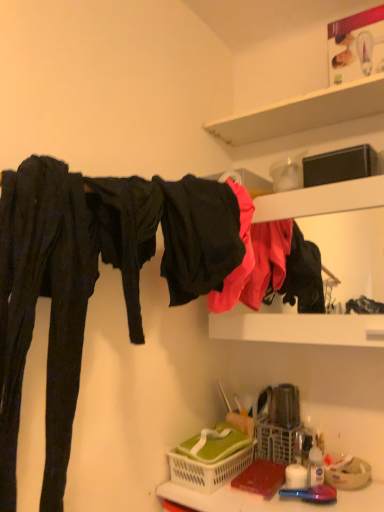
Question: Does black matte fabric at upper center come in front of green plastic basket at lower center, the 2th basket positioned from the right?

Choices:
 (A) no
 (B) yes

Answer: (B)

Question: Considering the relative sizes of black matte fabric at upper center and green plastic basket at lower center, the 2th basket positioned from the right, in the image provided, is black matte fabric at upper center thinner than green plastic basket at lower center, the 2th basket positioned from the right,?

Choices:
 (A) no
 (B) yes

Answer: (B)

Question: From a real-world perspective, is black matte fabric at upper center on top of green plastic basket at lower center, positioned as the 1th basket in left-to-right order?

Choices:
 (A) yes
 (B) no

Answer: (A)

Question: Can you confirm if black matte fabric at upper center is positioned to the left of green plastic basket at lower center, positioned as the 1th basket in left-to-right order?

Choices:
 (A) yes
 (B) no

Answer: (A)

Question: Can you confirm if black matte fabric at upper center is positioned to the right of green plastic basket at lower center, positioned as the 1th basket in left-to-right order?

Choices:
 (A) yes
 (B) no

Answer: (B)

Question: Can you confirm if black matte fabric at upper center is wider than green plastic basket at lower center, positioned as the 1th basket in left-to-right order?

Choices:
 (A) yes
 (B) no

Answer: (B)

Question: Can you confirm if translucent plastic basket at lower center is shorter than translucent plastic bottle at lower right?

Choices:
 (A) yes
 (B) no

Answer: (A)

Question: Is the surface of translucent plastic basket at lower center in direct contact with translucent plastic bottle at lower right?

Choices:
 (A) no
 (B) yes

Answer: (A)

Question: Can you confirm if translucent plastic basket at lower center is taller than translucent plastic bottle at lower right?

Choices:
 (A) no
 (B) yes

Answer: (A)

Question: Is translucent plastic basket at lower center looking in the opposite direction of translucent plastic bottle at lower right?

Choices:
 (A) no
 (B) yes

Answer: (A)

Question: Would you say translucent plastic basket at lower center is outside translucent plastic bottle at lower right?

Choices:
 (A) no
 (B) yes

Answer: (B)

Question: Could translucent plastic bottle at lower right be considered to be inside translucent plastic basket at lower center?

Choices:
 (A) no
 (B) yes

Answer: (A)

Question: From a real-world perspective, is white plastic basket at lower center, the first basket in the right-to-left sequence, located beneath matte black clothing at upper right?

Choices:
 (A) yes
 (B) no

Answer: (A)